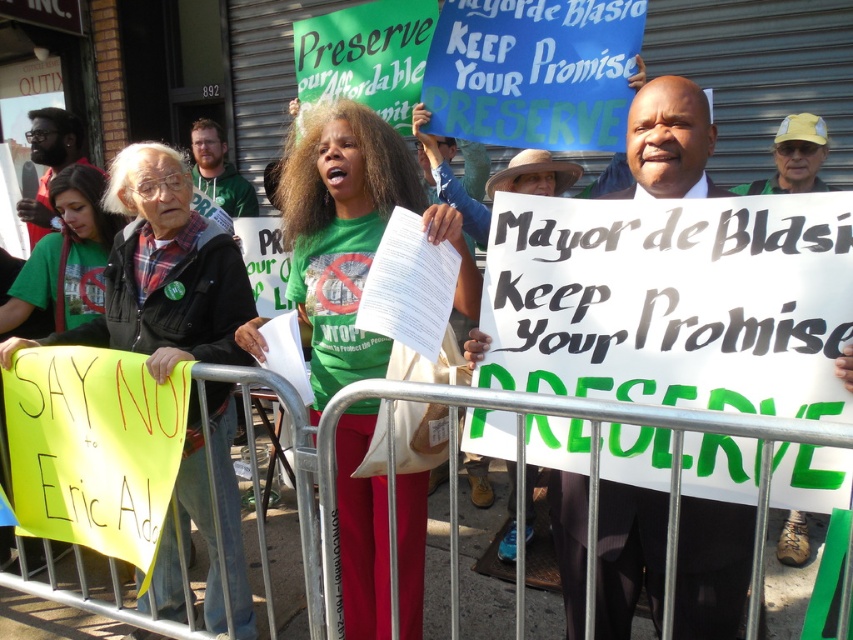
Which of these two, green fabric shirt at center or green fabric shirt at lower left, stands taller?

Standing taller between the two is green fabric shirt at center.

Is green fabric shirt at center wider than green fabric shirt at lower left?

Yes, green fabric shirt at center is wider than green fabric shirt at lower left.

Image resolution: width=853 pixels, height=640 pixels. I want to click on green fabric shirt at center, so click(350, 236).

Identify the location of green fabric shirt at center. The width and height of the screenshot is (853, 640). (350, 236).

Is white paper sign at center further to camera compared to green fabric shirt at lower left?

That is False.

Between point (471, 332) and point (56, 176), which one is positioned in front?

Positioned in front is point (471, 332).

Between point (631, 580) and point (96, 177), which one is positioned in front?

Positioned in front is point (631, 580).

You are a GUI agent. You are given a task and a screenshot of the screen. Output one action in this format:
    pyautogui.click(x=<x>, y=<y>)
    Task: Click on the white paper sign at center
    This screenshot has height=640, width=853.
    Given the screenshot: What is the action you would take?
    (x=711, y=566)

Is green fabric shirt at center wider than white paper sign at center?

Correct, the width of green fabric shirt at center exceeds that of white paper sign at center.

Between point (358, 579) and point (680, 636), which one is positioned in front?

Point (680, 636) is in front.

You are a GUI agent. You are given a task and a screenshot of the screen. Output one action in this format:
    pyautogui.click(x=<x>, y=<y>)
    Task: Click on the green fabric shirt at center
    The width and height of the screenshot is (853, 640).
    Given the screenshot: What is the action you would take?
    pyautogui.click(x=350, y=236)